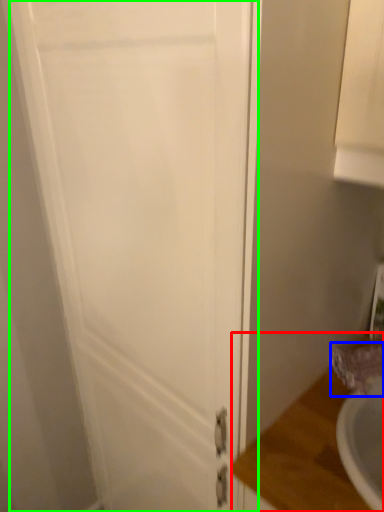
Question: Estimate the real-world distances between objects in this image. Which object is closer to counter top (highlighted by a red box), faucet (highlighted by a blue box) or door (highlighted by a green box)?

Choices:
 (A) faucet
 (B) door

Answer: (A)